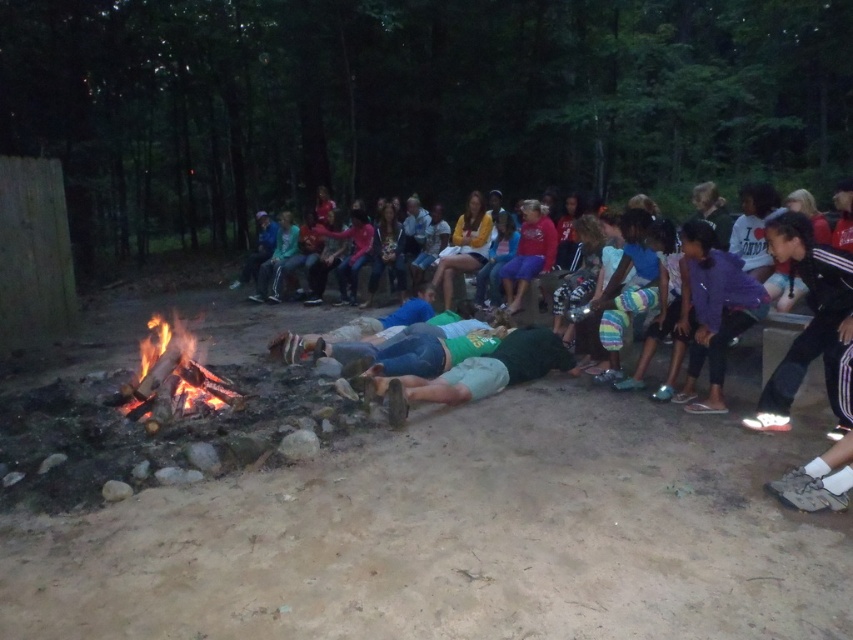
Who is positioned more to the right, green fabric shirt at center or flaming wood fire at center?

green fabric shirt at center is more to the right.

Is point (349, 365) positioned before point (195, 339)?

That is True.

You are a GUI agent. You are given a task and a screenshot of the screen. Output one action in this format:
    pyautogui.click(x=<x>, y=<y>)
    Task: Click on the green fabric shirt at center
    
    Given the screenshot: What is the action you would take?
    pyautogui.click(x=834, y=429)

Locate an element on the screen. The width and height of the screenshot is (853, 640). green fabric shirt at center is located at coordinates (834, 429).